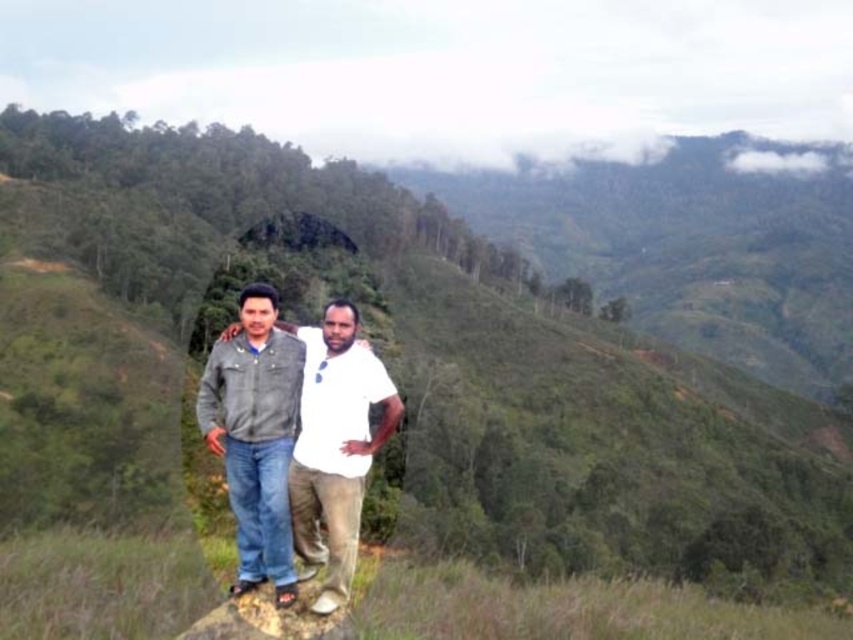
You are a hiker who wants to place a small backpack between the denim jacket at center and the smooth gray rock at lower center. Can you fit the backpack there if it measures 18 inches in length?

The denim jacket at center is 20.52 inches from the smooth gray rock at lower center. Since the backpack is 18 inches long, it should fit between them as the distance is sufficient.

You are a hiker who wants to place a small backpack on the smooth gray rock at lower center. However, there is already a denim jacket at center on it. Can you still place your backpack there?

The denim jacket at center is positioned over smooth gray rock at lower center, so the smooth gray rock at lower center is currently occupied by the denim jacket at center. You may need to move the jacket or choose another location for your backpack.